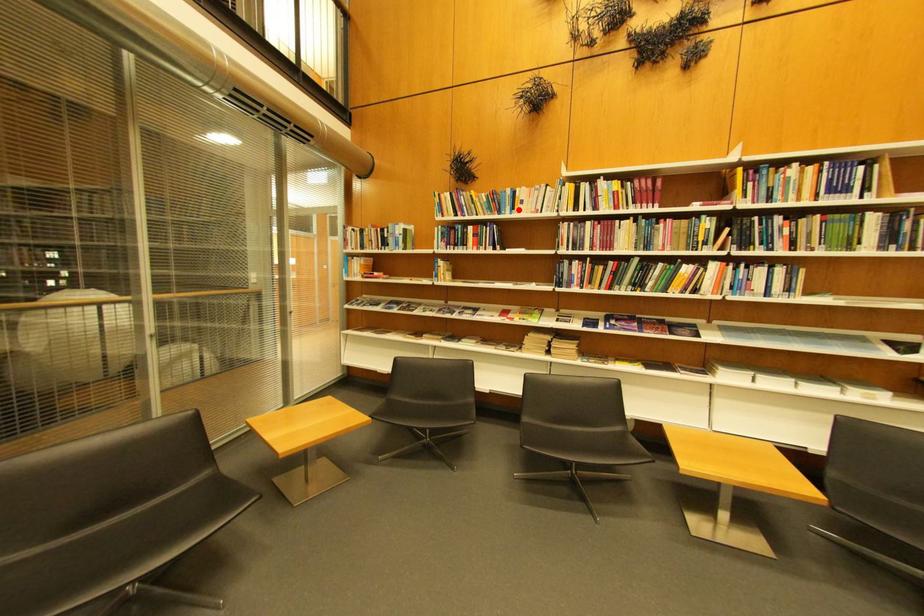
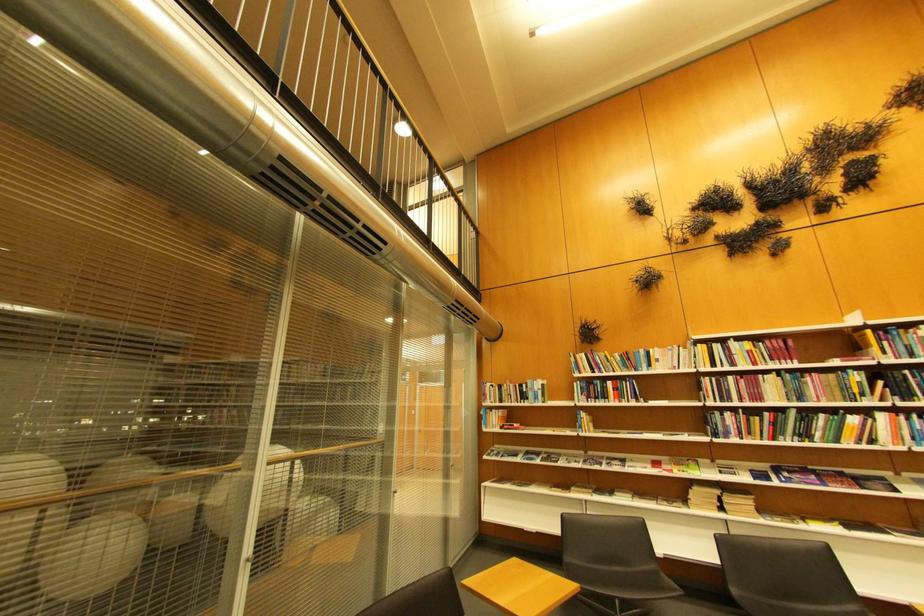
Find the pixel in the second image that matches the highlighted location in the first image.

(654, 368)